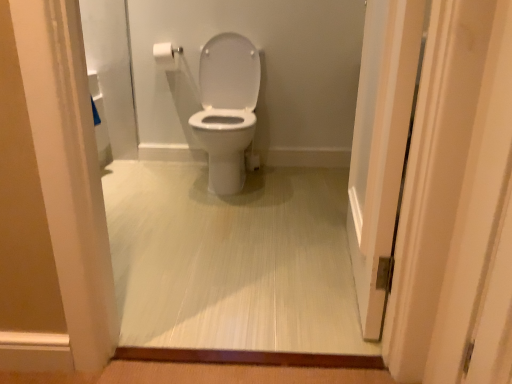
This screenshot has width=512, height=384. Find the location of `vacant space to the right of white glossy toilet at center`. vacant space to the right of white glossy toilet at center is located at coordinates (301, 182).